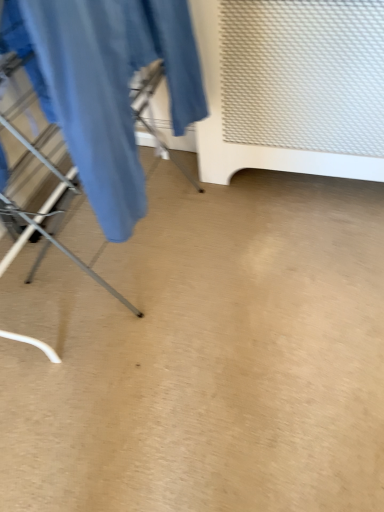
Question: Considering their positions, is white textured radiator at upper right located in front of or behind matte blue fabric at left?

Choices:
 (A) behind
 (B) front

Answer: (A)

Question: From a real-world perspective, relative to matte blue fabric at left, is white textured radiator at upper right vertically above or below?

Choices:
 (A) above
 (B) below

Answer: (B)

Question: Do you think white textured radiator at upper right is within matte blue fabric at left, or outside of it?

Choices:
 (A) outside
 (B) inside

Answer: (A)

Question: Looking at their shapes, would you say matte blue fabric at left is wider or thinner than white textured radiator at upper right?

Choices:
 (A) thin
 (B) wide

Answer: (A)

Question: In terms of height, does matte blue fabric at left look taller or shorter compared to white textured radiator at upper right?

Choices:
 (A) tall
 (B) short

Answer: (B)

Question: Which is correct: matte blue fabric at left is inside white textured radiator at upper right, or outside of it?

Choices:
 (A) inside
 (B) outside

Answer: (B)

Question: Considering the positions of point (124, 94) and point (274, 144), is point (124, 94) closer or farther from the camera than point (274, 144)?

Choices:
 (A) farther
 (B) closer

Answer: (B)